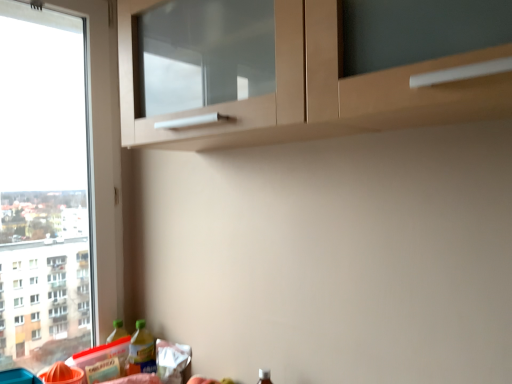
This screenshot has width=512, height=384. What do you see at coordinates (141, 351) in the screenshot? I see `translucent plastic bottle at lower left, the first bottle when ordered from right to left` at bounding box center [141, 351].

Identify the location of translucent plastic bottle at lower left, arranged as the 2th bottle when viewed from the left. (141, 351).

In order to click on translucent plastic bottle at lower left, which is counted as the first bottle, starting from the left in this screenshot , I will do `click(118, 332)`.

What do you see at coordinates (118, 332) in the screenshot? I see `translucent plastic bottle at lower left, which is counted as the first bottle, starting from the left` at bounding box center [118, 332].

Measure the distance between point (114,322) and camera.

4.92 feet.

This screenshot has width=512, height=384. Identify the location of translucent plastic bottle at lower left, arranged as the 2th bottle when viewed from the left. (141, 351).

Does translucent plastic bottle at lower left, the second bottle viewed from the right, appear on the left side of translucent plastic bottle at lower left, the first bottle when ordered from right to left?

Correct, you'll find translucent plastic bottle at lower left, the second bottle viewed from the right, to the left of translucent plastic bottle at lower left, the first bottle when ordered from right to left.

Which is in front, translucent plastic bottle at lower left, the second bottle viewed from the right, or translucent plastic bottle at lower left, the first bottle when ordered from right to left?

translucent plastic bottle at lower left, the first bottle when ordered from right to left, is in front.

Considering the points (124, 374) and (144, 343), which point is behind, point (124, 374) or point (144, 343)?

The point (144, 343) is more distant.

From the image's perspective, is translucent plastic bottle at lower left, the second bottle viewed from the right, over translucent plastic bottle at lower left, the first bottle when ordered from right to left?

No, from the image's perspective, translucent plastic bottle at lower left, the second bottle viewed from the right, is not over translucent plastic bottle at lower left, the first bottle when ordered from right to left.

From a real-world perspective, does translucent plastic bottle at lower left, which is counted as the first bottle, starting from the left, stand above translucent plastic bottle at lower left, arranged as the 2th bottle when viewed from the left?

Yes, from a real-world perspective, translucent plastic bottle at lower left, which is counted as the first bottle, starting from the left, is over translucent plastic bottle at lower left, arranged as the 2th bottle when viewed from the left

Considering the sizes of translucent plastic bottle at lower left, the second bottle viewed from the right, and translucent plastic bottle at lower left, the first bottle when ordered from right to left, in the image, is translucent plastic bottle at lower left, the second bottle viewed from the right, wider or thinner than translucent plastic bottle at lower left, the first bottle when ordered from right to left,?

translucent plastic bottle at lower left, the second bottle viewed from the right, is wider than translucent plastic bottle at lower left, the first bottle when ordered from right to left.

Considering the relative sizes of translucent plastic bottle at lower left, the second bottle viewed from the right, and translucent plastic bottle at lower left, arranged as the 2th bottle when viewed from the left, in the image provided, is translucent plastic bottle at lower left, the second bottle viewed from the right, shorter than translucent plastic bottle at lower left, arranged as the 2th bottle when viewed from the left,?

Incorrect, the height of translucent plastic bottle at lower left, the second bottle viewed from the right, does not fall short of that of translucent plastic bottle at lower left, arranged as the 2th bottle when viewed from the left.

Can you confirm if translucent plastic bottle at lower left, the second bottle viewed from the right, is bigger than translucent plastic bottle at lower left, the first bottle when ordered from right to left?

Actually, translucent plastic bottle at lower left, the second bottle viewed from the right, might be smaller than translucent plastic bottle at lower left, the first bottle when ordered from right to left.

Is translucent plastic bottle at lower left, the second bottle viewed from the right, positioned beyond the bounds of translucent plastic bottle at lower left, arranged as the 2th bottle when viewed from the left?

That's correct, translucent plastic bottle at lower left, the second bottle viewed from the right, is outside of translucent plastic bottle at lower left, arranged as the 2th bottle when viewed from the left.

Are translucent plastic bottle at lower left, the second bottle viewed from the right, and translucent plastic bottle at lower left, arranged as the 2th bottle when viewed from the left, beside each other?

Yes, translucent plastic bottle at lower left, the second bottle viewed from the right, is beside translucent plastic bottle at lower left, arranged as the 2th bottle when viewed from the left.

Is translucent plastic bottle at lower left, the second bottle viewed from the right, looking in the opposite direction of translucent plastic bottle at lower left, arranged as the 2th bottle when viewed from the left?

No.

Locate an element on the screen. bottle that appears above the translucent plastic bottle at lower left, the second bottle viewed from the right (from the image's perspective) is located at coordinates (141, 351).

Does translucent plastic bottle at lower left, arranged as the 2th bottle when viewed from the left, appear on the left side of translucent plastic bottle at lower left, which is counted as the first bottle, starting from the left?

In fact, translucent plastic bottle at lower left, arranged as the 2th bottle when viewed from the left, is to the right of translucent plastic bottle at lower left, which is counted as the first bottle, starting from the left.

Relative to translucent plastic bottle at lower left, which is counted as the first bottle, starting from the left, is translucent plastic bottle at lower left, the first bottle when ordered from right to left, in front or behind?

In the image, translucent plastic bottle at lower left, the first bottle when ordered from right to left, appears in front of translucent plastic bottle at lower left, which is counted as the first bottle, starting from the left.

Considering the points (133, 359) and (117, 319), which point is in front, point (133, 359) or point (117, 319)?

The point (133, 359) is closer.

From the image's perspective, is translucent plastic bottle at lower left, arranged as the 2th bottle when viewed from the left, located beneath translucent plastic bottle at lower left, which is counted as the first bottle, starting from the left?

No, from the image's perspective, translucent plastic bottle at lower left, arranged as the 2th bottle when viewed from the left, is not below translucent plastic bottle at lower left, which is counted as the first bottle, starting from the left.

From a real-world perspective, is translucent plastic bottle at lower left, the first bottle when ordered from right to left, physically located above or below translucent plastic bottle at lower left, the second bottle viewed from the right?

In terms of real-world spatial position, translucent plastic bottle at lower left, the first bottle when ordered from right to left, is below translucent plastic bottle at lower left, the second bottle viewed from the right.

Which of these two, translucent plastic bottle at lower left, the first bottle when ordered from right to left, or translucent plastic bottle at lower left, which is counted as the first bottle, starting from the left, is wider?

translucent plastic bottle at lower left, which is counted as the first bottle, starting from the left.

Considering the relative sizes of translucent plastic bottle at lower left, the first bottle when ordered from right to left, and translucent plastic bottle at lower left, which is counted as the first bottle, starting from the left, in the image provided, is translucent plastic bottle at lower left, the first bottle when ordered from right to left, shorter than translucent plastic bottle at lower left, which is counted as the first bottle, starting from the left,?

Correct, translucent plastic bottle at lower left, the first bottle when ordered from right to left, is not as tall as translucent plastic bottle at lower left, which is counted as the first bottle, starting from the left.

Considering the sizes of objects translucent plastic bottle at lower left, arranged as the 2th bottle when viewed from the left, and translucent plastic bottle at lower left, which is counted as the first bottle, starting from the left, in the image provided, who is smaller, translucent plastic bottle at lower left, arranged as the 2th bottle when viewed from the left, or translucent plastic bottle at lower left, which is counted as the first bottle, starting from the left,?

Smaller between the two is translucent plastic bottle at lower left, which is counted as the first bottle, starting from the left.

Is translucent plastic bottle at lower left, the first bottle when ordered from right to left, situated inside translucent plastic bottle at lower left, which is counted as the first bottle, starting from the left, or outside?

translucent plastic bottle at lower left, the first bottle when ordered from right to left, is not inside translucent plastic bottle at lower left, which is counted as the first bottle, starting from the left, it's outside.

Are translucent plastic bottle at lower left, arranged as the 2th bottle when viewed from the left, and translucent plastic bottle at lower left, the second bottle viewed from the right, far apart?

No, translucent plastic bottle at lower left, arranged as the 2th bottle when viewed from the left, is in close proximity to translucent plastic bottle at lower left, the second bottle viewed from the right.

Does translucent plastic bottle at lower left, arranged as the 2th bottle when viewed from the left, turn towards translucent plastic bottle at lower left, which is counted as the first bottle, starting from the left?

No, translucent plastic bottle at lower left, arranged as the 2th bottle when viewed from the left, does not turn towards translucent plastic bottle at lower left, which is counted as the first bottle, starting from the left.

How many degrees apart are the facing directions of translucent plastic bottle at lower left, the first bottle when ordered from right to left, and translucent plastic bottle at lower left, which is counted as the first bottle, starting from the left?

0.00878 degrees separate the facing orientations of translucent plastic bottle at lower left, the first bottle when ordered from right to left, and translucent plastic bottle at lower left, which is counted as the first bottle, starting from the left.

The image size is (512, 384). I want to click on bottle that is behind the translucent plastic bottle at lower left, arranged as the 2th bottle when viewed from the left, so [x=118, y=332].

Find the location of `bottle above the translucent plastic bottle at lower left, which is counted as the first bottle, starting from the left (from the image's perspective)`. bottle above the translucent plastic bottle at lower left, which is counted as the first bottle, starting from the left (from the image's perspective) is located at coordinates (141, 351).

In the image, there is a translucent plastic bottle at lower left, arranged as the 2th bottle when viewed from the left. In order to click on bottle below it (from the image's perspective) in this screenshot , I will do click(118, 332).